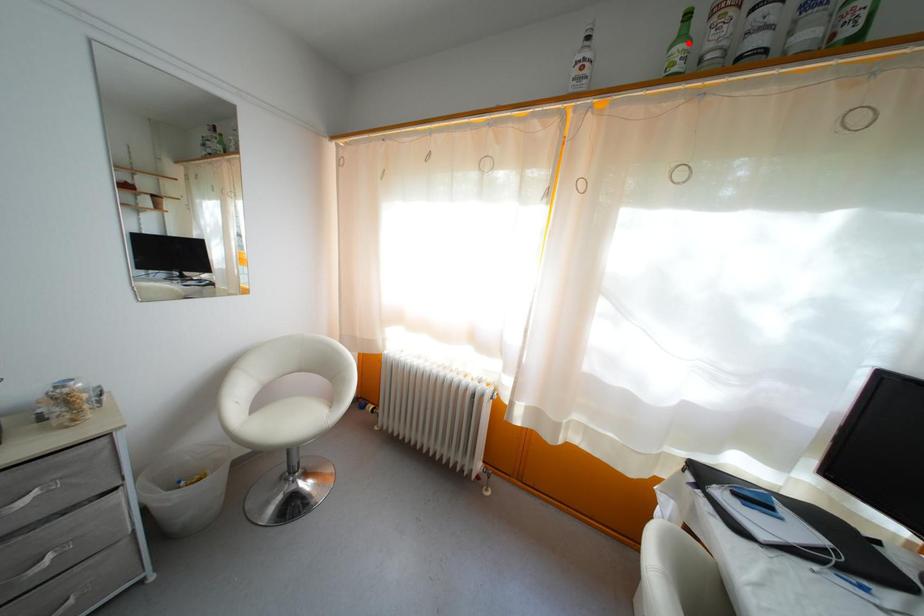
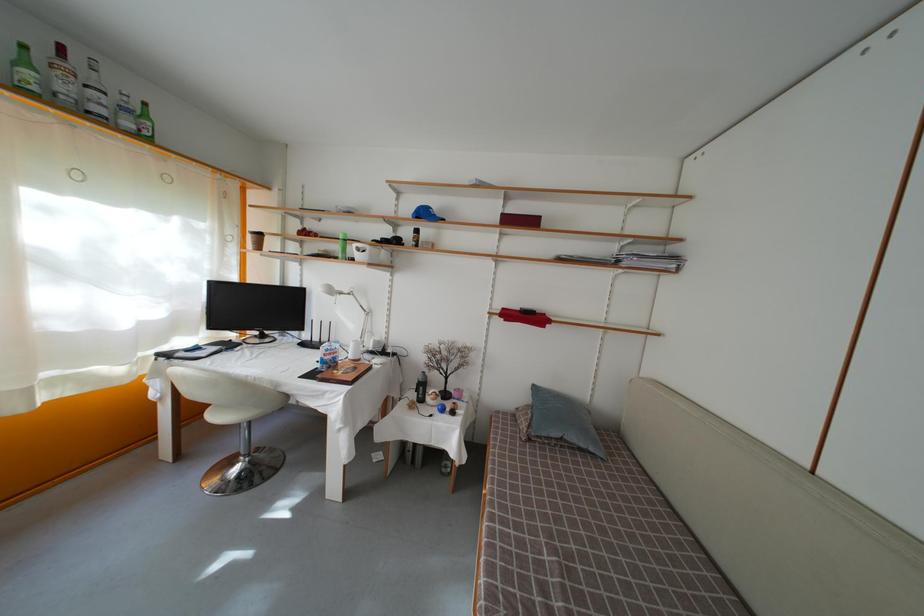
The point at the highlighted location is marked in the first image. Where is the corresponding point in the second image?

(31, 69)